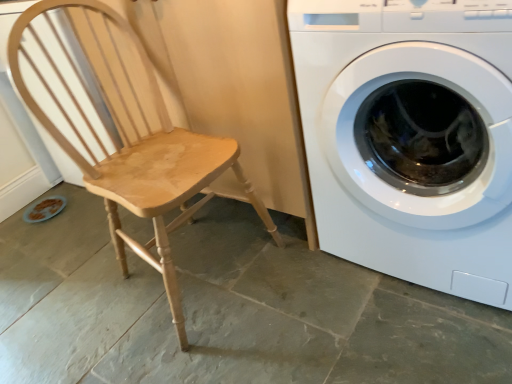
Question: Can we say light wood chair at left lies outside white glossy washing machine at right?

Choices:
 (A) no
 (B) yes

Answer: (B)

Question: Would you say white glossy washing machine at right is part of light wood chair at left's contents?

Choices:
 (A) no
 (B) yes

Answer: (A)

Question: From the image's perspective, is light wood chair at left beneath white glossy washing machine at right?

Choices:
 (A) no
 (B) yes

Answer: (B)

Question: Can you confirm if light wood chair at left is smaller than white glossy washing machine at right?

Choices:
 (A) no
 (B) yes

Answer: (B)

Question: Is light wood chair at left far away from white glossy washing machine at right?

Choices:
 (A) no
 (B) yes

Answer: (A)

Question: Considering the relative sizes of light wood chair at left and white glossy washing machine at right in the image provided, is light wood chair at left bigger than white glossy washing machine at right?

Choices:
 (A) no
 (B) yes

Answer: (A)

Question: Are white glossy washing machine at right and light wood chair at left beside each other?

Choices:
 (A) yes
 (B) no

Answer: (B)

Question: Considering the relative sizes of white glossy washing machine at right and light wood chair at left in the image provided, is white glossy washing machine at right wider than light wood chair at left?

Choices:
 (A) no
 (B) yes

Answer: (B)

Question: Does white glossy washing machine at right have a lesser height compared to light wood chair at left?

Choices:
 (A) no
 (B) yes

Answer: (B)

Question: Considering the relative sizes of white glossy washing machine at right and light wood chair at left in the image provided, is white glossy washing machine at right bigger than light wood chair at left?

Choices:
 (A) no
 (B) yes

Answer: (B)

Question: Is white glossy washing machine at right not inside light wood chair at left?

Choices:
 (A) no
 (B) yes

Answer: (B)

Question: Could you tell me if white glossy washing machine at right is turned towards light wood chair at left?

Choices:
 (A) yes
 (B) no

Answer: (B)

Question: In the image, is light wood chair at left positioned in front of or behind white glossy washing machine at right?

Choices:
 (A) front
 (B) behind

Answer: (B)